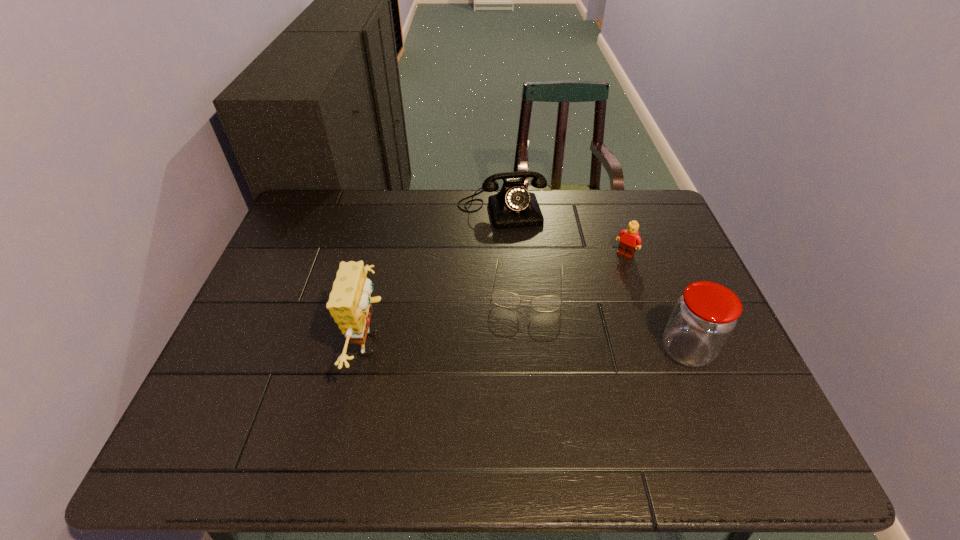
The height and width of the screenshot is (540, 960). What are the coordinates of `vacant space located on the front face of the farthest object` in the screenshot? It's located at (534, 321).

Find the location of a particular element. free space located 0.170m on the face of the Lego is located at coordinates (590, 293).

You are a GUI agent. You are given a task and a screenshot of the screen. Output one action in this format:
    pyautogui.click(x=<x>, y=<y>)
    Task: Click on the free space located 0.230m on the face of the Lego
    This screenshot has height=540, width=960.
    Given the screenshot: What is the action you would take?
    (x=579, y=306)

Identify the location of vacant region located on the face of the Lego. The width and height of the screenshot is (960, 540). (575, 311).

I want to click on vacant region located on the front-facing side of the spectacles, so click(523, 327).

Where is `vacant space located on the front-facing side of the spectacles`? Image resolution: width=960 pixels, height=540 pixels. vacant space located on the front-facing side of the spectacles is located at coordinates (517, 391).

Locate an element on the screen. The height and width of the screenshot is (540, 960). vacant space situated on the front-facing side of the spectacles is located at coordinates (520, 357).

You are a GUI agent. You are given a task and a screenshot of the screen. Output one action in this format:
    pyautogui.click(x=<x>, y=<y>)
    Task: Click on the object at the far edge
    
    Given the screenshot: What is the action you would take?
    pyautogui.click(x=513, y=207)

This screenshot has width=960, height=540. Identify the location of object present at the near edge. (349, 304).

Find the location of a particular element. This screenshot has width=960, height=540. jar that is at the right edge is located at coordinates (704, 317).